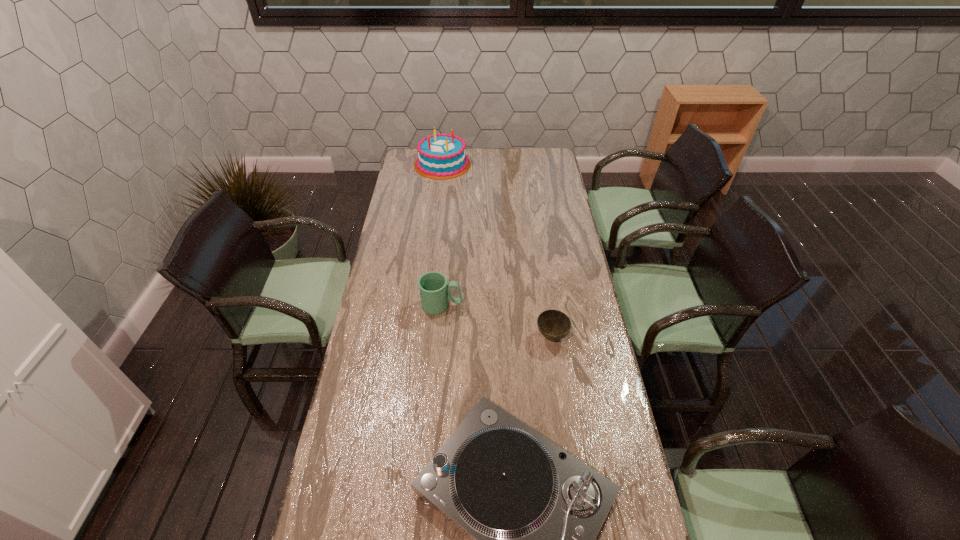
Identify the location of free point between the shortest object and the second tallest object. Image resolution: width=960 pixels, height=540 pixels. (496, 321).

Where is `free spot between the second farthest object and the shortest object`? This screenshot has height=540, width=960. free spot between the second farthest object and the shortest object is located at coordinates (496, 321).

Image resolution: width=960 pixels, height=540 pixels. Identify the location of vacant area between the bowl and the tallest object. (497, 251).

Image resolution: width=960 pixels, height=540 pixels. Find the location of `object that is the third closest to the nearest object`. object that is the third closest to the nearest object is located at coordinates (442, 156).

The width and height of the screenshot is (960, 540). Identify the location of the third closest object to the mug. (442, 156).

Find the location of a particular element. The width and height of the screenshot is (960, 540). free space that satisfies the following two spatial constraints: 1. on the side of the shortest object with the handle; 2. on the left side of the third nearest object is located at coordinates (439, 337).